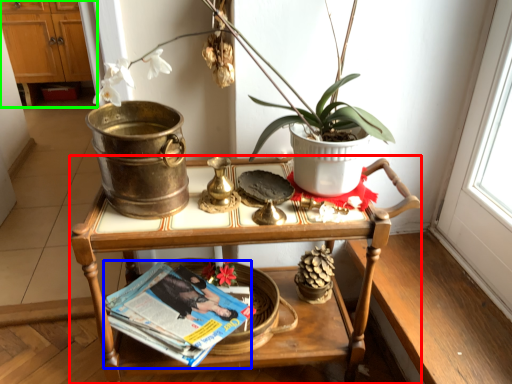
Question: Which object is the farthest from table (highlighted by a red box)? Choose among these: magazine (highlighted by a blue box) or dresser (highlighted by a green box).

Choices:
 (A) magazine
 (B) dresser

Answer: (B)